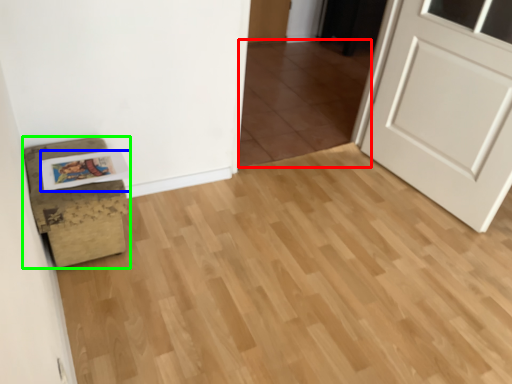
Question: Which object is the closest to the tile (highlighted by a red box)? Choose among these: postcard (highlighted by a blue box) or furniture (highlighted by a green box).

Choices:
 (A) postcard
 (B) furniture

Answer: (B)